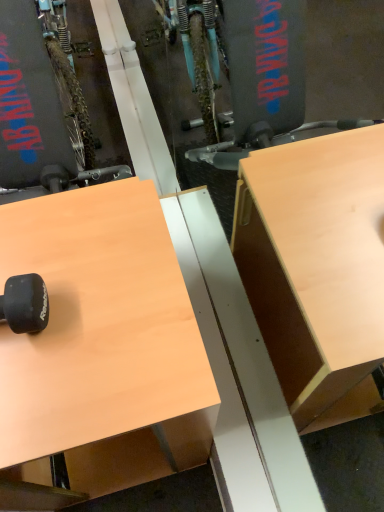
Question: From a real-world perspective, is black rubber dumbbell at lower left physically located above or below light brown wood desk at upper left?

Choices:
 (A) below
 (B) above

Answer: (B)

Question: Is black rubber dumbbell at lower left inside or outside of light brown wood desk at upper left?

Choices:
 (A) inside
 (B) outside

Answer: (B)

Question: Is black rubber dumbbell at lower left wider or thinner than light brown wood desk at upper left?

Choices:
 (A) thin
 (B) wide

Answer: (A)

Question: From a real-world perspective, relative to black rubber dumbbell at lower left, is light brown wood desk at upper left vertically above or below?

Choices:
 (A) above
 (B) below

Answer: (B)

Question: From the image's perspective, relative to black rubber dumbbell at lower left, is light brown wood desk at upper left above or below?

Choices:
 (A) above
 (B) below

Answer: (B)

Question: Considering their positions, is light brown wood desk at upper left located in front of or behind black rubber dumbbell at lower left?

Choices:
 (A) behind
 (B) front

Answer: (B)

Question: Do you think light brown wood desk at upper left is within black rubber dumbbell at lower left, or outside of it?

Choices:
 (A) inside
 (B) outside

Answer: (B)